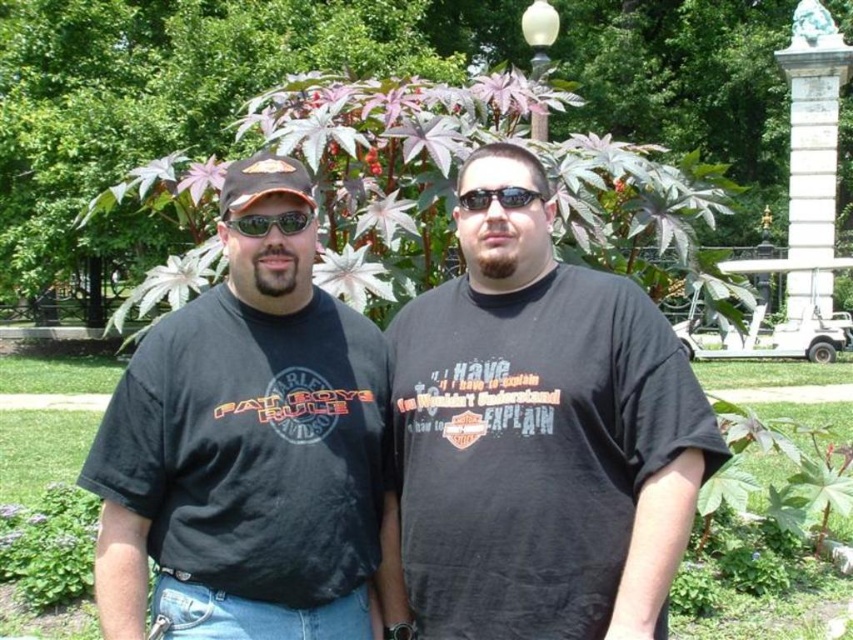
Question: Can you confirm if purple leafy plant at center is smaller than black plastic sunglasses at center?

Choices:
 (A) yes
 (B) no

Answer: (B)

Question: Which object is farther from the camera taking this photo?

Choices:
 (A) black cotton t-shirt at center
 (B) black plastic sunglasses at center
 (C) purple leafy plant at center

Answer: (C)

Question: Which of the following is the closest to the observer?

Choices:
 (A) (247, 509)
 (B) (415, 316)
 (C) (614, 90)
 (D) (276, 220)

Answer: (A)

Question: Which of these objects is positioned closest to the purple leafy plant at center?

Choices:
 (A) black plastic sunglasses at center
 (B) sunglasses at center
 (C) black cotton t-shirt at center
 (D) black cotton t-shirt at left

Answer: (C)

Question: Can you confirm if purple leafy plant at center is wider than black plastic sunglasses at center?

Choices:
 (A) yes
 (B) no

Answer: (A)

Question: Does purple leafy plant at center have a larger size compared to black plastic sunglasses at center?

Choices:
 (A) no
 (B) yes

Answer: (B)